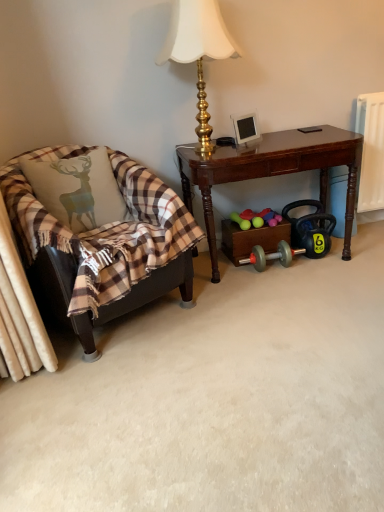
What do you see at coordinates (272, 170) in the screenshot?
I see `dark wood desk at center` at bounding box center [272, 170].

What is the approximate width of gold metallic lamp at upper center?

14.87 inches.

At what (x,y) coordinates should I click in order to perform the action: click on gold metallic lamp at upper center. Please return your answer as a coordinate pair (x, y). This screenshot has width=384, height=512. Looking at the image, I should click on (198, 51).

What is the approximate width of plaid fabric pillow at left?

10.15 inches.

The width and height of the screenshot is (384, 512). What do you see at coordinates (78, 190) in the screenshot? I see `plaid fabric pillow at left` at bounding box center [78, 190].

Identify the location of dark wood desk at center. The height and width of the screenshot is (512, 384). (272, 170).

In terms of height, does gold metallic lamp at upper center look taller or shorter compared to plaid fabric pillow at left?

Considering their sizes, gold metallic lamp at upper center has more height than plaid fabric pillow at left.

Would you consider gold metallic lamp at upper center to be distant from plaid fabric pillow at left?

No.

Does point (193, 54) come farther from viewer compared to point (69, 187)?

That is False.

In the image, is gold metallic lamp at upper center positioned in front of or behind plaid fabric pillow at left?

gold metallic lamp at upper center is in front of plaid fabric pillow at left.

Is dark wood desk at center oriented away from gold metallic lamp at upper center?

dark wood desk at center does not have its back to gold metallic lamp at upper center.

Based on their sizes in the image, would you say dark wood desk at center is bigger or smaller than gold metallic lamp at upper center?

dark wood desk at center is bigger than gold metallic lamp at upper center.

How much distance is there between dark wood desk at center and gold metallic lamp at upper center?

24.25 inches.

Find the location of a particular element. The width and height of the screenshot is (384, 512). lamp above the dark wood desk at center (from a real-world perspective) is located at coordinates (198, 51).

Does plaid fabric chair at left have a greater height compared to gold metallic lamp at upper center?

Yes, plaid fabric chair at left is taller than gold metallic lamp at upper center.

From the image's perspective, relative to gold metallic lamp at upper center, is plaid fabric chair at left above or below?

Clearly, from the image's perspective, plaid fabric chair at left is below gold metallic lamp at upper center.

Image resolution: width=384 pixels, height=512 pixels. I want to click on chair below the gold metallic lamp at upper center (from the image's perspective), so pyautogui.click(x=105, y=232).

Is plaid fabric chair at left thinner than gold metallic lamp at upper center?

No, plaid fabric chair at left is not thinner than gold metallic lamp at upper center.

Measure the distance from gold metallic lamp at upper center to dark wood desk at center.

gold metallic lamp at upper center is 24.25 inches from dark wood desk at center.

Is point (220, 14) positioned before point (226, 175)?

No.

Considering the relative positions of gold metallic lamp at upper center and dark wood desk at center in the image provided, is gold metallic lamp at upper center to the left of dark wood desk at center from the viewer's perspective?

Yes, gold metallic lamp at upper center is to the left of dark wood desk at center.

From a real-world perspective, relative to dark wood desk at center, is gold metallic lamp at upper center vertically above or below?

Clearly, from a real-world perspective, gold metallic lamp at upper center is above dark wood desk at center.

Is dark wood desk at center positioned in front of plaid fabric chair at left?

No, dark wood desk at center is behind plaid fabric chair at left.

From the image's perspective, is dark wood desk at center over plaid fabric chair at left?

Correct, dark wood desk at center appears higher than plaid fabric chair at left in the image.

Is plaid fabric chair at left at the back of dark wood desk at center?

dark wood desk at center does not have its back to plaid fabric chair at left.

Does dark wood desk at center have a greater height compared to plaid fabric chair at left?

No, dark wood desk at center is not taller than plaid fabric chair at left.

The width and height of the screenshot is (384, 512). Identify the location of pillow on the left side of gold metallic lamp at upper center. (78, 190).

Do you think plaid fabric pillow at left is within gold metallic lamp at upper center, or outside of it?

plaid fabric pillow at left is spatially situated outside gold metallic lamp at upper center.

From a real-world perspective, who is located lower, plaid fabric pillow at left or gold metallic lamp at upper center?

From a 3D spatial view, plaid fabric pillow at left is below.

From the image's perspective, is plaid fabric pillow at left below gold metallic lamp at upper center?

Yes.

Which is more to the right, plaid fabric pillow at left or plaid fabric chair at left?

From the viewer's perspective, plaid fabric chair at left appears more on the right side.

In terms of width, does plaid fabric pillow at left look wider or thinner when compared to plaid fabric chair at left?

plaid fabric pillow at left is thinner than plaid fabric chair at left.

From a real-world perspective, between plaid fabric pillow at left and plaid fabric chair at left, who is vertically lower?

From a 3D spatial view, plaid fabric chair at left is below.

From the image's perspective, is plaid fabric pillow at left positioned above or below plaid fabric chair at left?

Based on their image positions, plaid fabric pillow at left is located above plaid fabric chair at left.

What are the coordinates of `pillow lying below the gold metallic lamp at upper center (from the image's perspective)` in the screenshot? It's located at (78, 190).

The width and height of the screenshot is (384, 512). In the image, there is a dark wood desk at center. In order to click on lamp above it (from the image's perspective) in this screenshot , I will do `click(198, 51)`.

When comparing their distances from plaid fabric pillow at left, does gold metallic lamp at upper center or dark wood desk at center seem further?

The object further to plaid fabric pillow at left is gold metallic lamp at upper center.

Based on their spatial positions, is gold metallic lamp at upper center or plaid fabric chair at left closer to dark wood desk at center?

Based on the image, plaid fabric chair at left appears to be nearer to dark wood desk at center.

Based on their spatial positions, is plaid fabric pillow at left or plaid fabric chair at left closer to gold metallic lamp at upper center?

plaid fabric pillow at left lies closer to gold metallic lamp at upper center than the other object.

Based on their spatial positions, is plaid fabric chair at left or gold metallic lamp at upper center closer to plaid fabric pillow at left?

plaid fabric chair at left lies closer to plaid fabric pillow at left than the other object.

When comparing their distances from gold metallic lamp at upper center, does plaid fabric chair at left or dark wood desk at center seem closer?

dark wood desk at center is positioned closer to the anchor gold metallic lamp at upper center.

Which object lies further to the anchor point plaid fabric chair at left, plaid fabric pillow at left or dark wood desk at center?

dark wood desk at center.

Estimate the real-world distances between objects in this image. Which object is further from plaid fabric pillow at left, dark wood desk at center or gold metallic lamp at upper center?

Among the two, gold metallic lamp at upper center is located further to plaid fabric pillow at left.

In the scene shown: Which object lies further to the anchor point dark wood desk at center, plaid fabric chair at left or gold metallic lamp at upper center?

gold metallic lamp at upper center.

Locate an element on the screen. Image resolution: width=384 pixels, height=512 pixels. chair between plaid fabric pillow at left and dark wood desk at center in the horizontal direction is located at coordinates (105, 232).

Locate an element on the screen. This screenshot has width=384, height=512. pillow between gold metallic lamp at upper center and plaid fabric chair at left from top to bottom is located at coordinates (78, 190).

This screenshot has height=512, width=384. Find the location of `lamp between plaid fabric pillow at left and dark wood desk at center`. lamp between plaid fabric pillow at left and dark wood desk at center is located at coordinates (198, 51).

Identify the location of lamp situated between plaid fabric chair at left and dark wood desk at center from left to right. The image size is (384, 512). (198, 51).